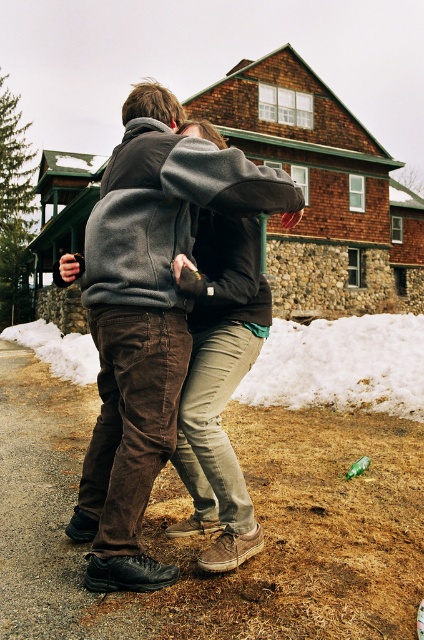
Question: Which point is closer to the camera?

Choices:
 (A) white powdery snow at lower center
 (B) brown corduroy pants at center

Answer: (B)

Question: Does brown corduroy pants at center have a lesser width compared to white powdery snow at lower center?

Choices:
 (A) no
 (B) yes

Answer: (B)

Question: Is brown corduroy pants at center bigger than white powdery snow at lower center?

Choices:
 (A) no
 (B) yes

Answer: (A)

Question: Is brown corduroy pants at center wider than white powdery snow at lower center?

Choices:
 (A) yes
 (B) no

Answer: (B)

Question: Among these objects, which one is farthest from the camera?

Choices:
 (A) brown corduroy pants at center
 (B) white powdery snow at lower center

Answer: (B)